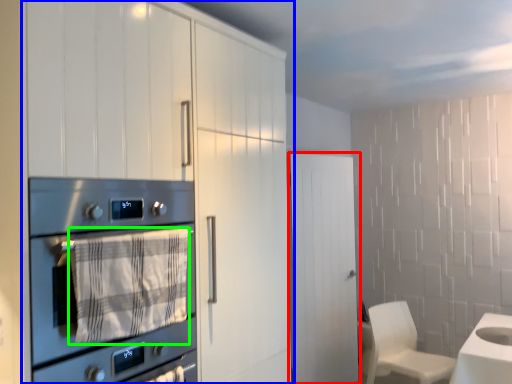
Question: Based on their relative distances, which object is nearer to door (highlighted by a red box)? Choose from cabinetry (highlighted by a blue box) and blanket (highlighted by a green box).

Choices:
 (A) cabinetry
 (B) blanket

Answer: (A)